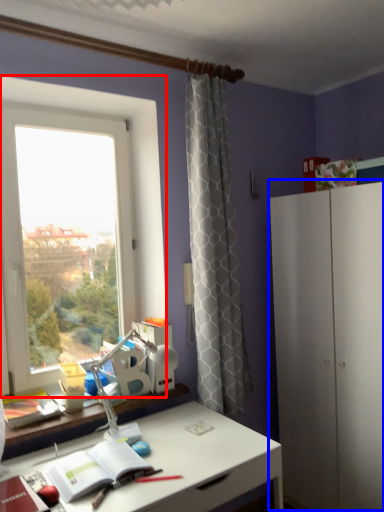
Question: Which object appears farthest to the camera in this image, window (highlighted by a red box) or dresser (highlighted by a blue box)?

Choices:
 (A) window
 (B) dresser

Answer: (A)